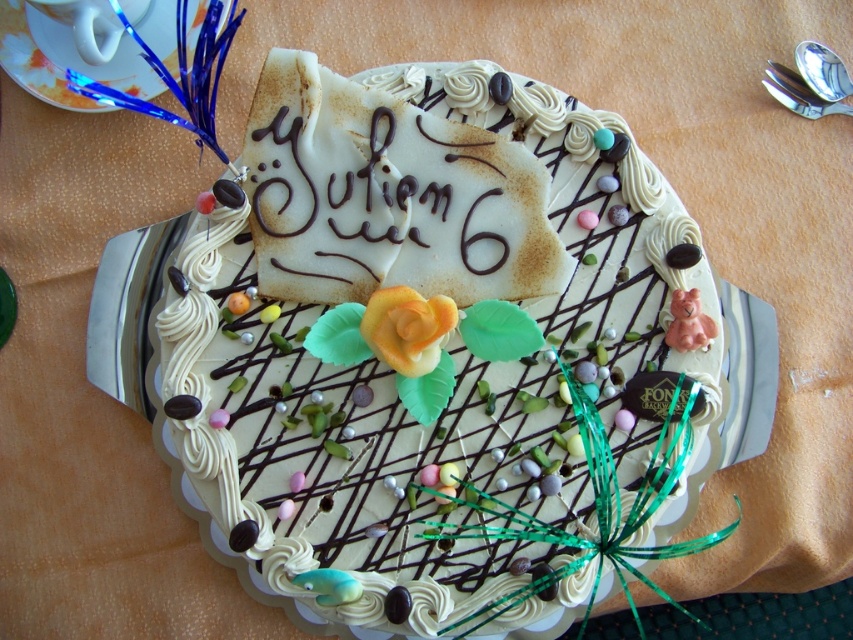
You are a guest at a birthday party and see the white cream cake at center and the metallic blue platter at upper left. Which object is closer to you from your vantage point?

The metallic blue platter at upper left is closer to you because it is positioned above the white cream cake at center, which is placed under it.

You are standing in front of the cake and want to take a photo of the point at coordinates point (x=227, y=289). If your camera has a minimum focus distance of 1.2 meters, will it be able to focus on that point?

The point (x=227, y=289) is 1.22 meters from the camera, which is beyond the minimum focus distance of 1.2 meters, so the camera can focus on it.

Based on the photo, you are a guest at a birthday party and see the white cream cake at center and the chocolate writing at center. Which object is bigger?

The white cream cake at center is larger in size compared to the chocolate writing at center.